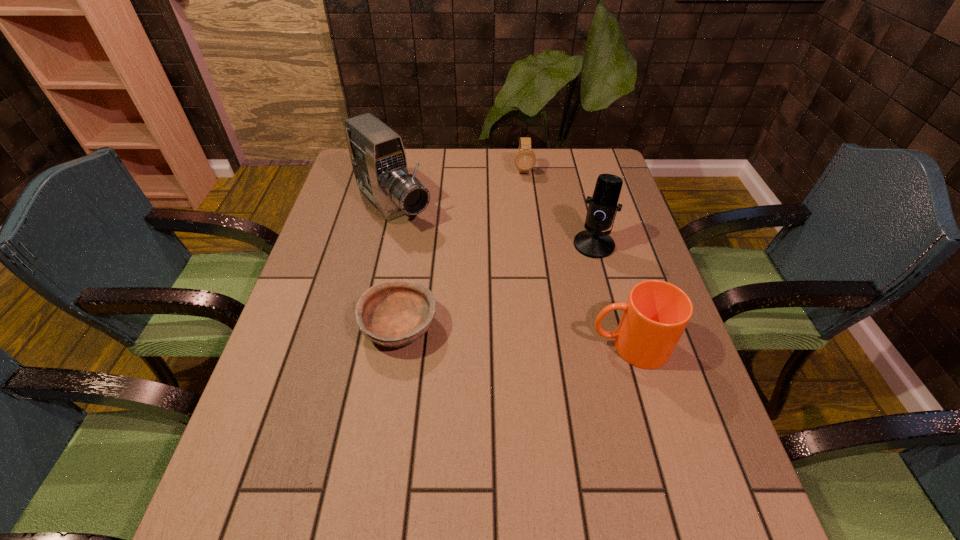
Identify the location of watch that is positioned at the far edge. This screenshot has height=540, width=960. (525, 159).

This screenshot has width=960, height=540. Find the location of `object at the left edge`. object at the left edge is located at coordinates (378, 157).

At what (x,y) coordinates should I click in order to perform the action: click on mug situated at the right edge. Please return your answer as a coordinate pair (x, y). The height and width of the screenshot is (540, 960). Looking at the image, I should click on (654, 317).

Find the location of a particular element. This screenshot has width=960, height=540. microphone present at the right edge is located at coordinates (592, 242).

The height and width of the screenshot is (540, 960). What are the coordinates of `object positioned at the far left corner` in the screenshot? It's located at (378, 157).

This screenshot has height=540, width=960. I want to click on free spot at the far edge of the desktop, so click(x=564, y=174).

This screenshot has height=540, width=960. In order to click on free spot at the near edge of the desktop in this screenshot , I will do `click(369, 476)`.

I want to click on vacant area at the left edge, so click(x=352, y=280).

This screenshot has height=540, width=960. Find the location of `vacant space at the near left corner of the desktop`. vacant space at the near left corner of the desktop is located at coordinates (290, 457).

Identify the location of vacant point at the far right corner. (593, 172).